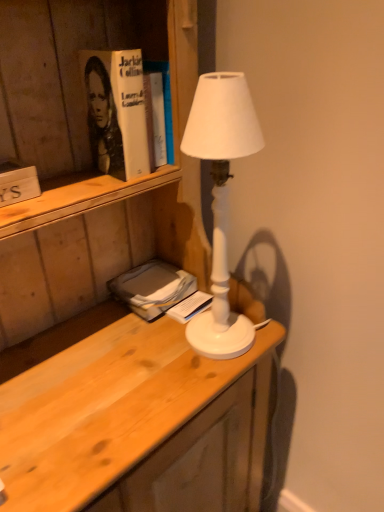
Question: Can you confirm if hardcover book at upper left is bigger than wooden sign at left, the third book in the bottom-to-top sequence?

Choices:
 (A) no
 (B) yes

Answer: (B)

Question: Is hardcover book at upper left shorter than wooden sign at left, which ranks as the 1th book in front-to-back order?

Choices:
 (A) no
 (B) yes

Answer: (A)

Question: From the image's perspective, does hardcover book at upper left appear higher than wooden sign at left, which is counted as the first book, starting from the left?

Choices:
 (A) no
 (B) yes

Answer: (B)

Question: Is hardcover book at upper left not near wooden sign at left, which is counted as the first book, starting from the left?

Choices:
 (A) yes
 (B) no

Answer: (B)

Question: From a real-world perspective, is hardcover book at upper left positioned under wooden sign at left, which is counted as the first book, starting from the left, based on gravity?

Choices:
 (A) no
 (B) yes

Answer: (A)

Question: Is hardcover book at upper left thinner than wooden sign at left, the third book in the bottom-to-top sequence?

Choices:
 (A) yes
 (B) no

Answer: (B)

Question: Is wooden sign at left, which is the 3th book in back-to-front order, oriented towards white paper book at center, which is the third book from left to right?

Choices:
 (A) yes
 (B) no

Answer: (B)

Question: From a real-world perspective, is wooden sign at left, which is the 3th book in back-to-front order, beneath white paper book at center, which is the third book from top to bottom?

Choices:
 (A) no
 (B) yes

Answer: (A)

Question: From a real-world perspective, is wooden sign at left, which is counted as the first book, starting from the left, over white paper book at center, which is the third book from left to right?

Choices:
 (A) no
 (B) yes

Answer: (B)

Question: Can you confirm if wooden sign at left, the third book when ordered from right to left, is smaller than white paper book at center, which is counted as the first book, starting from the back?

Choices:
 (A) no
 (B) yes

Answer: (A)

Question: Considering the relative positions of wooden sign at left, which is counted as the first book, starting from the left, and white paper book at center, which is counted as the first book, starting from the bottom, in the image provided, is wooden sign at left, which is counted as the first book, starting from the left, in front of white paper book at center, which is counted as the first book, starting from the bottom,?

Choices:
 (A) no
 (B) yes

Answer: (B)

Question: Considering the relative sizes of wooden sign at left, which is the 3th book in back-to-front order, and white paper book at center, which is the third book from top to bottom, in the image provided, is wooden sign at left, which is the 3th book in back-to-front order, thinner than white paper book at center, which is the third book from top to bottom,?

Choices:
 (A) yes
 (B) no

Answer: (B)

Question: Are white paper book at center, which is the third book from top to bottom, and white matte lamp at center far apart?

Choices:
 (A) no
 (B) yes

Answer: (A)